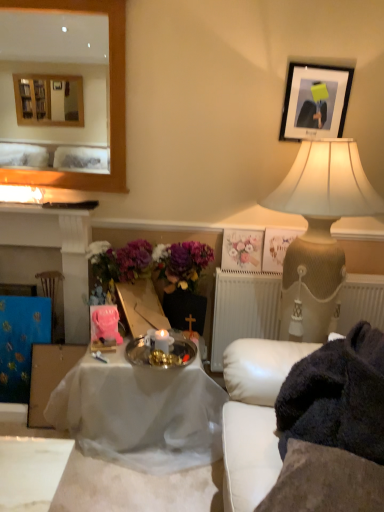
Image resolution: width=384 pixels, height=512 pixels. I want to click on vacant region above matte black fireplace at left (from a real-world perspective), so click(x=48, y=205).